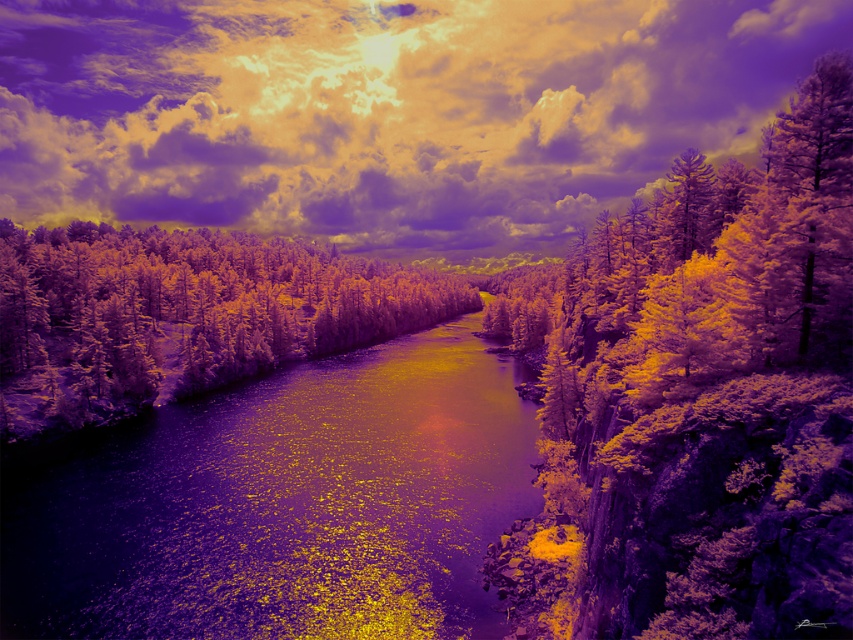
Question: Can you confirm if purple textured tree at right is smaller than shiny metallic river at center?

Choices:
 (A) no
 (B) yes

Answer: (A)

Question: Observing the image, what is the correct spatial positioning of purple textured tree at right in reference to green matte trees at center?

Choices:
 (A) left
 (B) right

Answer: (B)

Question: Can you confirm if cloudy sky at upper center is thinner than purple textured tree at right?

Choices:
 (A) yes
 (B) no

Answer: (B)

Question: Estimate the real-world distances between objects in this image. Which object is closer to the shiny metallic river at center?

Choices:
 (A) purple textured tree at right
 (B) cloudy sky at upper center

Answer: (A)

Question: Which object is positioned farthest from the purple textured tree at right?

Choices:
 (A) shiny metallic river at center
 (B) cloudy sky at upper center
 (C) green matte trees at center

Answer: (B)

Question: Which object is the farthest from the purple textured tree at right?

Choices:
 (A) shiny metallic river at center
 (B) cloudy sky at upper center

Answer: (B)